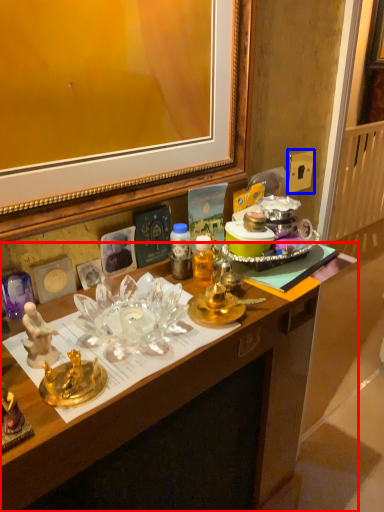
Question: Which object appears closest to the camera in this image, desk (highlighted by a red box) or power outlet (highlighted by a blue box)?

Choices:
 (A) desk
 (B) power outlet

Answer: (A)